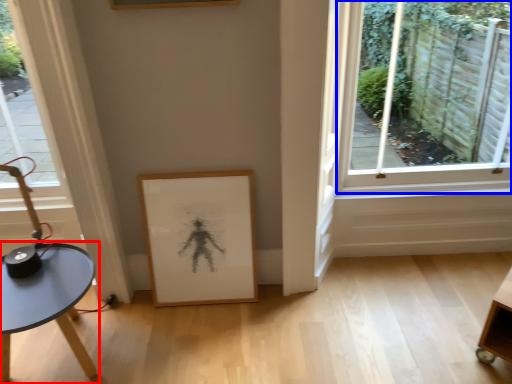
Question: Which object is further to the camera taking this photo, table (highlighted by a red box) or window (highlighted by a blue box)?

Choices:
 (A) table
 (B) window

Answer: (B)